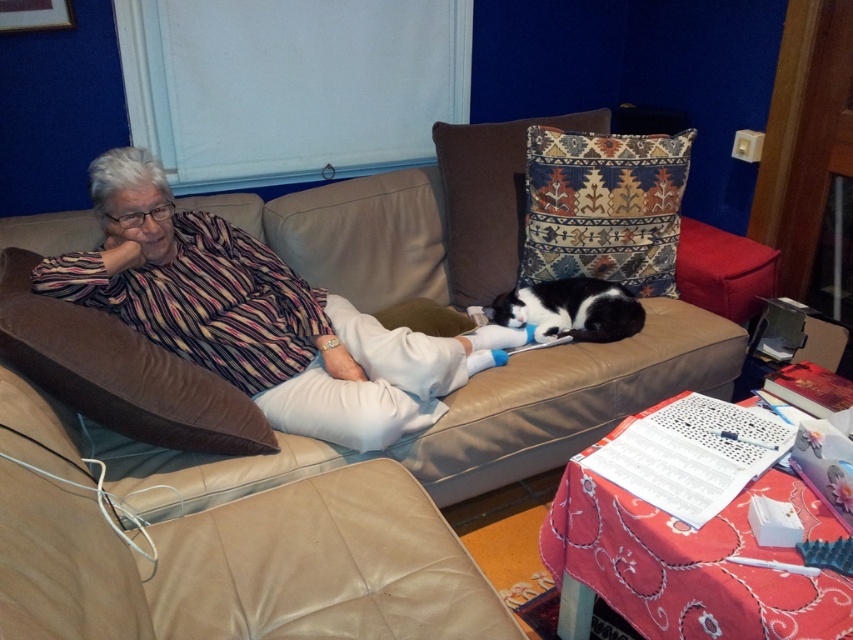
Who is shorter, striped fabric shirt at center or brown velvety pillow at left?

brown velvety pillow at left

This screenshot has width=853, height=640. Find the location of `striped fabric shirt at center`. striped fabric shirt at center is located at coordinates (258, 316).

Is point (648, 182) in front of point (601, 282)?

Yes.

Is textured woolen pillow at upper center wider than black fur cat at center?

Correct, the width of textured woolen pillow at upper center exceeds that of black fur cat at center.

Is point (550, 266) farther from viewer compared to point (509, 320)?

Yes, it is.

In order to click on textured woolen pillow at upper center in this screenshot , I will do `click(602, 208)`.

Is striped fabric shirt at center above black fur cat at center?

Yes, striped fabric shirt at center is above black fur cat at center.

Does striped fabric shirt at center have a smaller size compared to black fur cat at center?

Incorrect, striped fabric shirt at center is not smaller in size than black fur cat at center.

The height and width of the screenshot is (640, 853). What do you see at coordinates (258, 316) in the screenshot?
I see `striped fabric shirt at center` at bounding box center [258, 316].

Locate an element on the screen. This screenshot has height=640, width=853. striped fabric shirt at center is located at coordinates (258, 316).